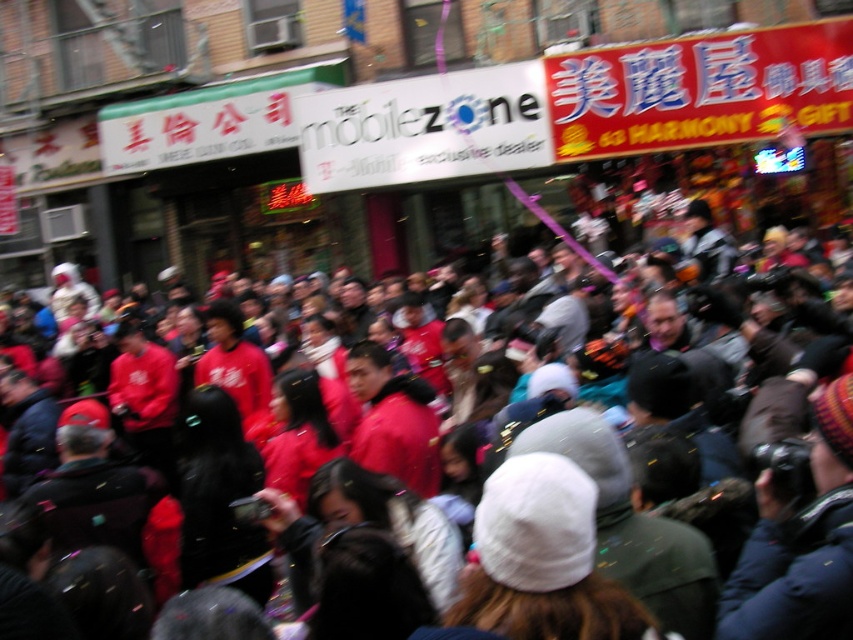
Question: Estimate the real-world distances between objects in this image. Which object is farther from the red matte jackets at center?

Choices:
 (A) white matte sign at center
 (B) knitted wool hat at center

Answer: (A)

Question: Which is farther from the red matte jackets at center?

Choices:
 (A) white matte sign at center
 (B) knitted wool hat at center

Answer: (A)

Question: Can you confirm if white matte sign at center is positioned to the left of knitted wool hat at center?

Choices:
 (A) no
 (B) yes

Answer: (B)

Question: Observing the image, what is the correct spatial positioning of red matte jackets at center in reference to knitted wool hat at center?

Choices:
 (A) right
 (B) left

Answer: (B)

Question: Which point is closer to the camera?

Choices:
 (A) white matte sign at center
 (B) red matte jackets at center

Answer: (B)

Question: Can you confirm if white matte sign at center is smaller than red matte jackets at center?

Choices:
 (A) yes
 (B) no

Answer: (A)